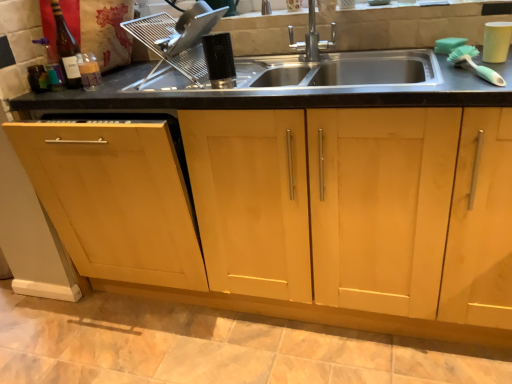
Find the location of a particular element. blank space to the left of black plastic comb at center, positioned as the 2th appliance in left-to-right order is located at coordinates (166, 89).